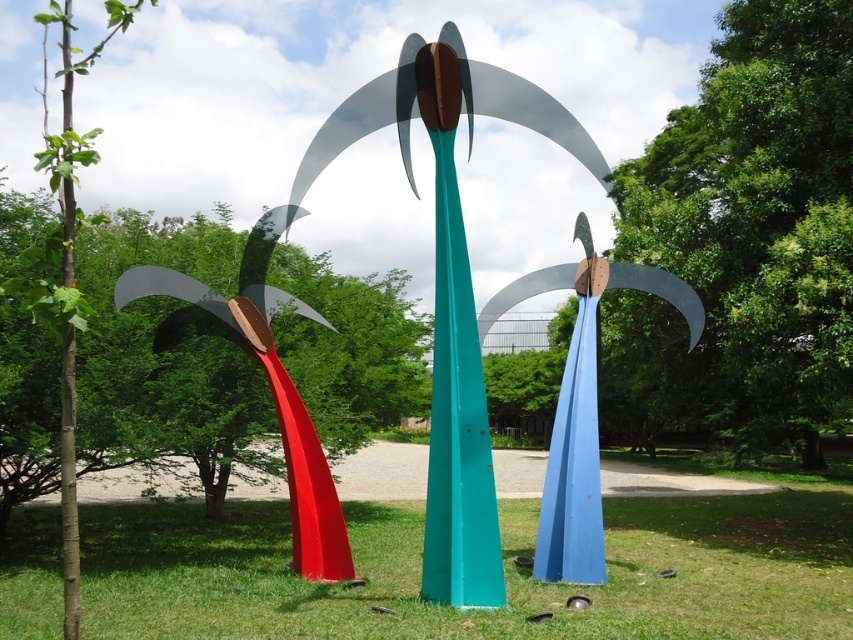
Question: Among these points, which one is nearest to the camera?

Choices:
 (A) coord(434,573)
 (B) coord(115,403)

Answer: (A)

Question: Is teal glossy pole at center further to the viewer compared to glossy metal palm tree at left?

Choices:
 (A) no
 (B) yes

Answer: (A)

Question: Can you confirm if green grass at center is smaller than metallic red palm tree at left?

Choices:
 (A) no
 (B) yes

Answer: (B)

Question: Which point is closer to the camera taking this photo?

Choices:
 (A) (136, 404)
 (B) (802, 499)

Answer: (A)

Question: Does green grass at center have a greater width compared to metallic red palm tree at left?

Choices:
 (A) no
 (B) yes

Answer: (B)

Question: Considering the real-world distances, which object is closest to the metallic red palm tree at left?

Choices:
 (A) teal glossy pole at center
 (B) glossy metal palm tree at left

Answer: (B)